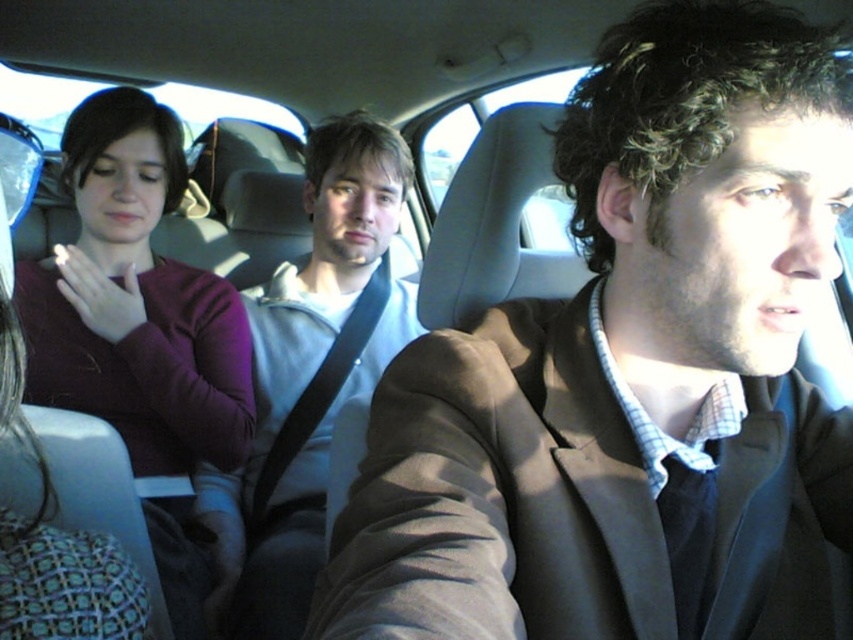
Which of these two, brown fabric jacket at center or light gray hoodie at center, stands taller?

Standing taller between the two is light gray hoodie at center.

Does point (793, 456) lie behind point (291, 564)?

No, it is in front of (291, 564).

Who is more forward, [669,49] or [335,198]?

Positioned in front is point [669,49].

This screenshot has width=853, height=640. Find the location of `brown fabric jacket at center`. brown fabric jacket at center is located at coordinates (630, 371).

Does brown fabric jacket at center have a larger size compared to purple sweater at left?

Incorrect, brown fabric jacket at center is not larger than purple sweater at left.

Between point (469, 444) and point (27, 352), which one is positioned in front?

Positioned in front is point (469, 444).

You are a GUI agent. You are given a task and a screenshot of the screen. Output one action in this format:
    pyautogui.click(x=<x>, y=<y>)
    Task: Click on the brown fabric jacket at center
    The image size is (853, 640).
    Given the screenshot: What is the action you would take?
    tap(630, 371)

Does purple sweater at left lie in front of light gray hoodie at center?

Yes, purple sweater at left is in front of light gray hoodie at center.

Describe the element at coordinates (135, 301) in the screenshot. I see `purple sweater at left` at that location.

Locate an element on the screen. The image size is (853, 640). purple sweater at left is located at coordinates (135, 301).